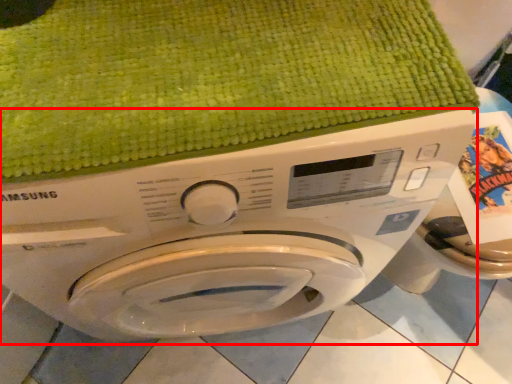
Question: Where is washing machine (annotated by the red box) located in relation to bath towel in the image?

Choices:
 (A) left
 (B) right

Answer: (A)